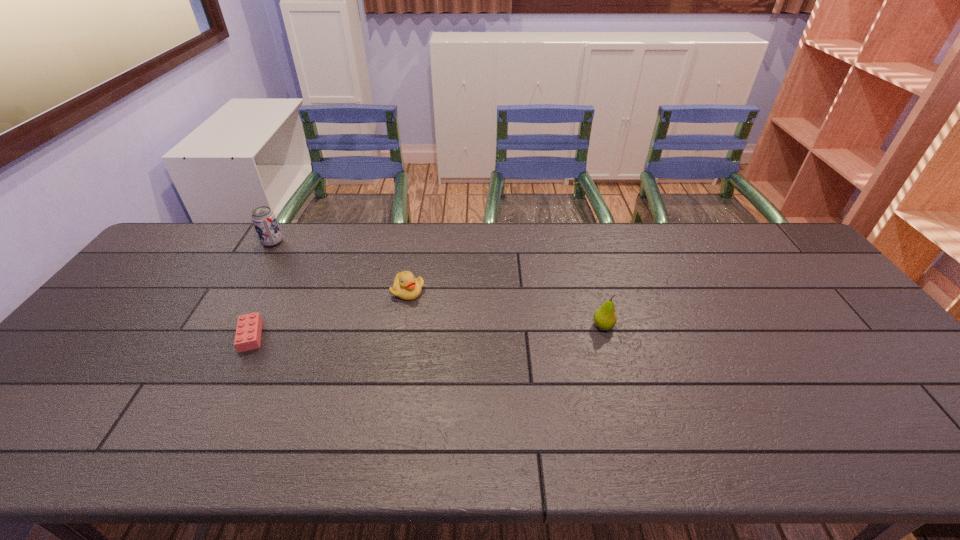
Image resolution: width=960 pixels, height=540 pixels. I want to click on unoccupied area between the beer can and the Lego, so click(x=262, y=289).

This screenshot has height=540, width=960. What are the coordinates of `vacant space that is in between the third nearest object and the beer can` in the screenshot? It's located at [340, 267].

Locate an element on the screen. The width and height of the screenshot is (960, 540). free space between the third tallest object and the second object from left to right is located at coordinates (329, 314).

Where is `vacant space that is in between the farthest object and the shortest object`? This screenshot has height=540, width=960. vacant space that is in between the farthest object and the shortest object is located at coordinates (262, 289).

Locate an element on the screen. free space between the rightmost object and the duckling is located at coordinates (506, 308).

This screenshot has width=960, height=540. In order to click on vacant region between the leftmost object and the third object from right to left in this screenshot , I will do (262, 289).

Choose which object is the third nearest neighbor to the beer can. Please provide its 2D coordinates. Your answer should be formatted as a tuple, i.e. [(x, y)], where the tuple contains the x and y coordinates of a point satisfying the conditions above.

[(605, 318)]

This screenshot has height=540, width=960. I want to click on object that can be found as the second closest to the pear, so click(x=248, y=332).

Where is `vacant space that satisfies the following two spatial constraints: 1. on the back side of the pear; 2. on the left side of the Lego`? vacant space that satisfies the following two spatial constraints: 1. on the back side of the pear; 2. on the left side of the Lego is located at coordinates (256, 326).

The height and width of the screenshot is (540, 960). In order to click on vacant space that satisfies the following two spatial constraints: 1. on the front-facing side of the third object from left to right; 2. on the left side of the pear in this screenshot , I will do `click(401, 326)`.